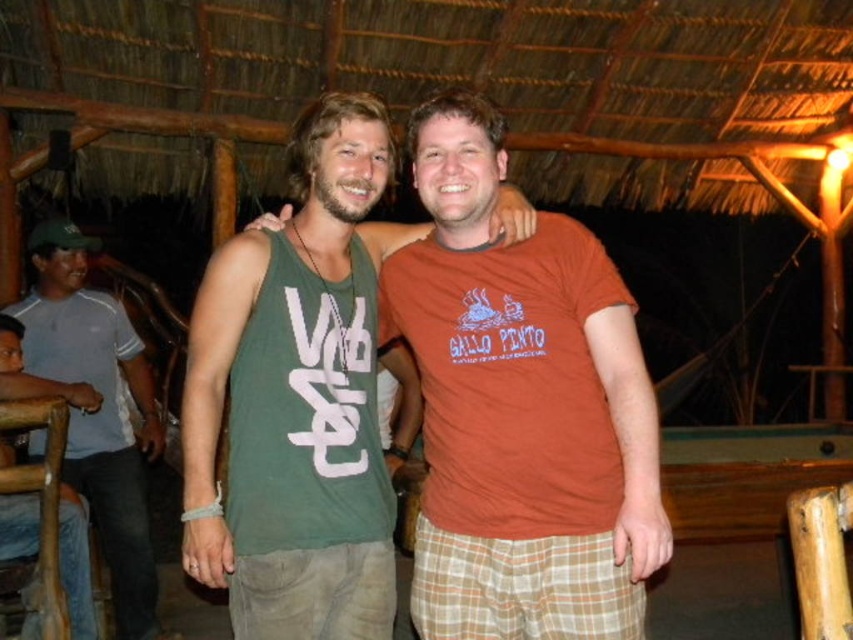
You are a photographer setting up for a group photo. You need to ensure there is enough space between the green cotton tank top at center and the jeans at left for proper framing. The minimum required space is 5 feet. Can you fit them within the frame?

The distance between the green cotton tank top at center and jeans at left is 4.90 feet, which is slightly less than the required 5 feet. They can be positioned closer to fit within the frame, but there will be minimal space left for proper framing.

You are taking a photo of two people standing in a rustic indoor setting with a thatched roof. You notice two points marked as point 1 at coordinates [86,497] and point 2 at [70,579]. Which point is closer to the camera?

Point 1 at coordinates [86,497] is further to the camera than point 2 at [70,579]. Therefore, point 2 is closer to the camera.

You are a fashion designer observing two people in a tropical setting. You notice the gray cotton shirt at left and jeans at left. Which clothing item is covering the other?

The gray cotton shirt at left is positioned over the jeans at left, so it is covering the jeans at left.